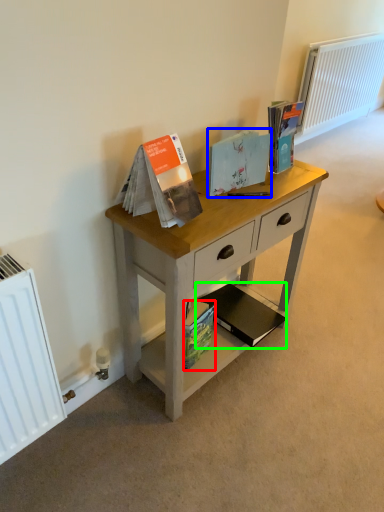
Question: Considering the real-world distances, which object is farthest from paperback book (highlighted by a red box)? paperback book (highlighted by a blue box) or paperback book (highlighted by a green box)?

Choices:
 (A) paperback book
 (B) paperback book

Answer: (A)